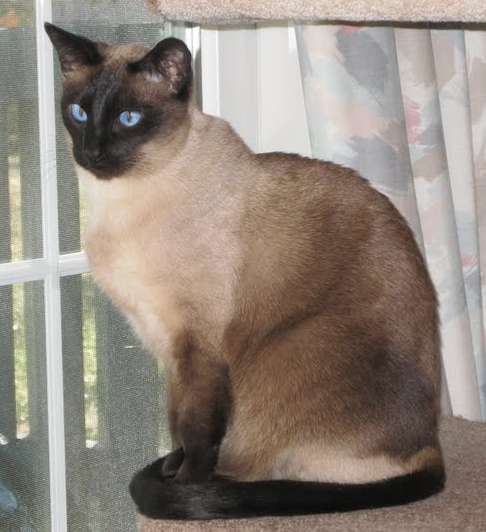
Where is `curtain`? The height and width of the screenshot is (532, 486). curtain is located at coordinates (424, 174).